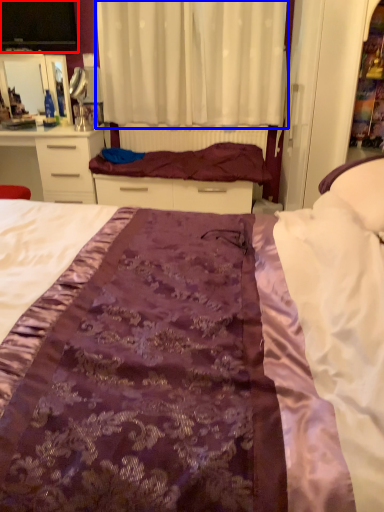
Question: Among these objects, which one is nearest to the camera, desktop (highlighted by a red box) or curtain (highlighted by a blue box)?

Choices:
 (A) desktop
 (B) curtain

Answer: (B)